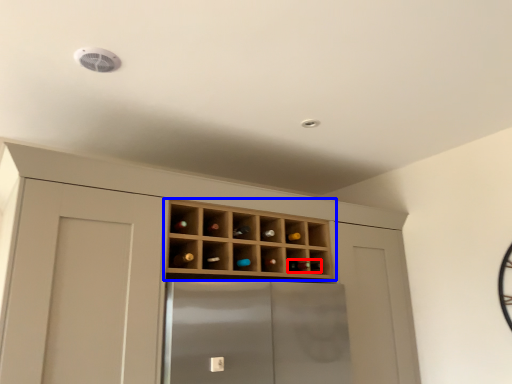
Question: Which object appears closest to the camera in this image, wine bottle (highlighted by a red box) or shelf (highlighted by a blue box)?

Choices:
 (A) wine bottle
 (B) shelf

Answer: (B)